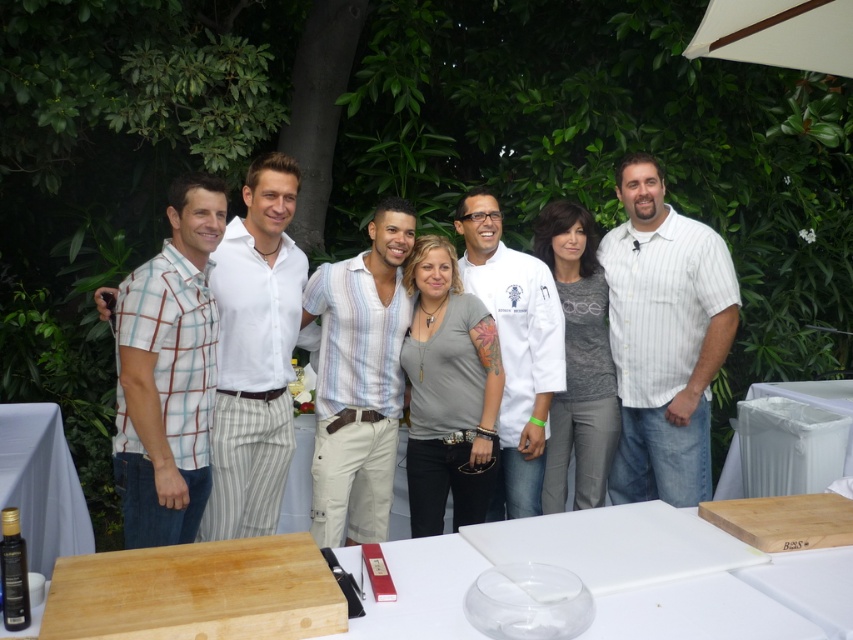
Does white striped shirt at center appear on the right side of striped cotton shirt at center?

Correct, you'll find white striped shirt at center to the right of striped cotton shirt at center.

At what (x,y) coordinates should I click in order to perform the action: click on white striped shirt at center. Please return your answer as a coordinate pair (x, y). The width and height of the screenshot is (853, 640). Looking at the image, I should click on (664, 339).

Find the location of a particular element. The image size is (853, 640). white striped shirt at center is located at coordinates (664, 339).

Does white striped shirt at center appear on the right side of gray matte shirt at center?

Yes, white striped shirt at center is to the right of gray matte shirt at center.

Which of these two, white striped shirt at center or gray matte shirt at center, stands taller?

With more height is white striped shirt at center.

Locate an element on the screen. The width and height of the screenshot is (853, 640). white striped shirt at center is located at coordinates (664, 339).

Is wooden cutting board at lower center shorter than striped cotton shirt at center?

Yes.

Can you confirm if wooden cutting board at lower center is positioned below striped cotton shirt at center?

Yes, wooden cutting board at lower center is below striped cotton shirt at center.

In order to click on wooden cutting board at lower center in this screenshot , I will do `click(624, 577)`.

Locate an element on the screen. The height and width of the screenshot is (640, 853). wooden cutting board at lower center is located at coordinates (624, 577).